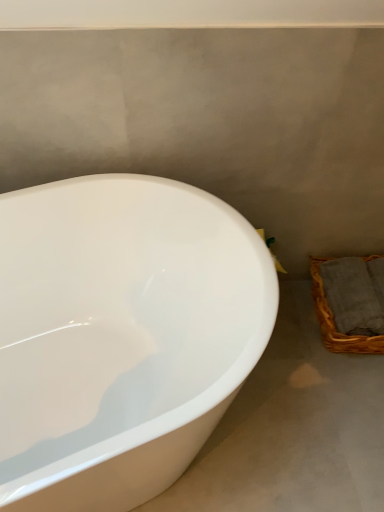
Describe the element at coordinates (120, 335) in the screenshot. I see `white glossy bathtub at left` at that location.

Find the location of `white glossy bathtub at left`. white glossy bathtub at left is located at coordinates (120, 335).

The image size is (384, 512). What do you see at coordinates (350, 303) in the screenshot? I see `woven brown basket at lower right` at bounding box center [350, 303].

The height and width of the screenshot is (512, 384). In order to click on woven brown basket at lower right in this screenshot , I will do `click(350, 303)`.

In order to click on white glossy bathtub at left in this screenshot , I will do `click(120, 335)`.

Based on their positions, is woven brown basket at lower right located to the left or right of white glossy bathtub at left?

Clearly, woven brown basket at lower right is on the right of white glossy bathtub at left in the image.

Considering the relative positions of woven brown basket at lower right and white glossy bathtub at left in the image provided, is woven brown basket at lower right behind white glossy bathtub at left?

Yes, it is.

Which point is more distant from viewer, (338, 283) or (153, 419)?

Point (338, 283)

From the image's perspective, which is above, woven brown basket at lower right or white glossy bathtub at left?

woven brown basket at lower right.

Consider the image. From a real-world perspective, is woven brown basket at lower right above or below white glossy bathtub at left?

Clearly, from a real-world perspective, woven brown basket at lower right is below white glossy bathtub at left.

Is woven brown basket at lower right thinner than white glossy bathtub at left?

Indeed, woven brown basket at lower right has a lesser width compared to white glossy bathtub at left.

Can you confirm if woven brown basket at lower right is taller than white glossy bathtub at left?

Incorrect, the height of woven brown basket at lower right is not larger of that of white glossy bathtub at left.

Considering the relative sizes of woven brown basket at lower right and white glossy bathtub at left in the image provided, is woven brown basket at lower right smaller than white glossy bathtub at left?

Yes.

Is woven brown basket at lower right inside the boundaries of white glossy bathtub at left, or outside?

woven brown basket at lower right cannot be found inside white glossy bathtub at left.

Is woven brown basket at lower right not near white glossy bathtub at left?

Actually, woven brown basket at lower right and white glossy bathtub at left are a little close together.

Is woven brown basket at lower right aimed at white glossy bathtub at left?

Yes, woven brown basket at lower right is turned towards white glossy bathtub at left.

How many degrees apart are the facing directions of woven brown basket at lower right and white glossy bathtub at left?

The angular difference between woven brown basket at lower right and white glossy bathtub at left is 113 degrees.

This screenshot has height=512, width=384. In order to click on bathtub above the woven brown basket at lower right (from a real-world perspective) in this screenshot , I will do `click(120, 335)`.

Is white glossy bathtub at left at the right side of woven brown basket at lower right?

No.

Is white glossy bathtub at left closer to the viewer compared to woven brown basket at lower right?

Yes, it is in front of woven brown basket at lower right.

Does point (199, 244) appear closer or farther from the camera than point (382, 298)?

Point (199, 244) is closer to the camera than point (382, 298).

From the image's perspective, which object appears higher, white glossy bathtub at left or woven brown basket at lower right?

A: woven brown basket at lower right, from the image's perspective.

From a real-world perspective, who is located higher, white glossy bathtub at left or woven brown basket at lower right?

white glossy bathtub at left is physically above.

Can you confirm if white glossy bathtub at left is thinner than woven brown basket at lower right?

Incorrect, the width of white glossy bathtub at left is not less than that of woven brown basket at lower right.

Considering the sizes of objects white glossy bathtub at left and woven brown basket at lower right in the image provided, who is taller, white glossy bathtub at left or woven brown basket at lower right?

white glossy bathtub at left is taller.

Can you confirm if white glossy bathtub at left is smaller than woven brown basket at lower right?

No, white glossy bathtub at left is not smaller than woven brown basket at lower right.

Choose the correct answer: Is white glossy bathtub at left inside woven brown basket at lower right or outside it?

white glossy bathtub at left is located beyond the bounds of woven brown basket at lower right.

Is white glossy bathtub at left with woven brown basket at lower right?

No, white glossy bathtub at left is not making contact with woven brown basket at lower right.

Does white glossy bathtub at left turn towards woven brown basket at lower right?

No.

The image size is (384, 512). Find the location of `bathtub that is above the woven brown basket at lower right (from a real-world perspective)`. bathtub that is above the woven brown basket at lower right (from a real-world perspective) is located at coordinates (120, 335).

You are a GUI agent. You are given a task and a screenshot of the screen. Output one action in this format:
    pyautogui.click(x=<x>, y=<y>)
    Task: Click on the basket on the right of the white glossy bathtub at left
    The width and height of the screenshot is (384, 512).
    Given the screenshot: What is the action you would take?
    pyautogui.click(x=350, y=303)

Find the location of a particular element. The width and height of the screenshot is (384, 512). bathtub on the left of the woven brown basket at lower right is located at coordinates (120, 335).